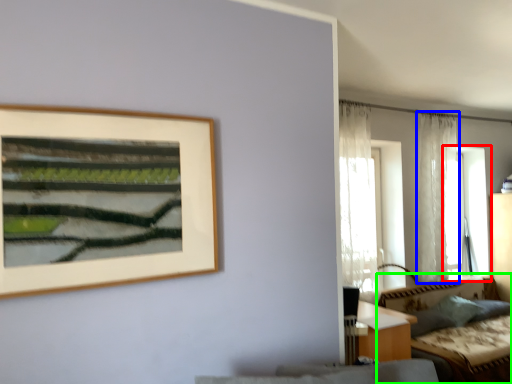
Question: Which object is positioned closest to window (highlighted by a red box)? Select from curtain (highlighted by a blue box) and couch (highlighted by a green box).

Choices:
 (A) curtain
 (B) couch

Answer: (A)